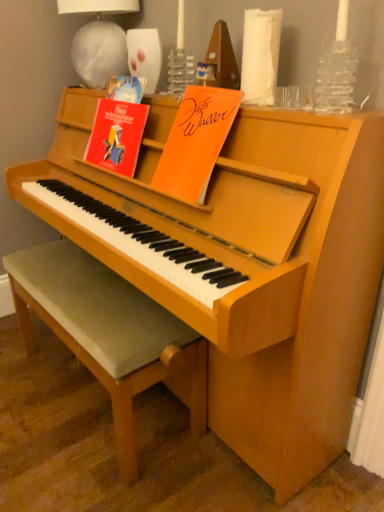
Where is `free space above light brown wooden stool at center (from a real-world perspective)`? free space above light brown wooden stool at center (from a real-world perspective) is located at coordinates (88, 279).